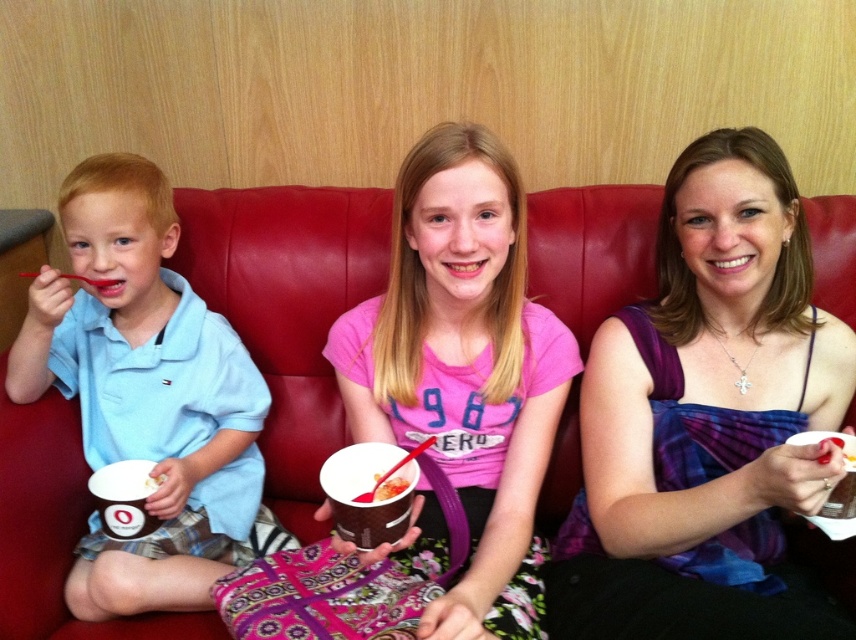
Does point (278, 504) come closer to viewer compared to point (174, 532)?

No, (278, 504) is further to viewer.

Which is above, red leather couch at center or light blue cotton shirt at left?

red leather couch at center

The image size is (856, 640). In order to click on red leather couch at center in this screenshot , I will do `click(287, 308)`.

You are a GUI agent. You are given a task and a screenshot of the screen. Output one action in this format:
    pyautogui.click(x=<x>, y=<y>)
    Task: Click on the red leather couch at center
    The height and width of the screenshot is (640, 856).
    Given the screenshot: What is the action you would take?
    pyautogui.click(x=287, y=308)

Which of these two, purple satin dress at center or light blue cotton shirt at left, stands shorter?

purple satin dress at center is shorter.

Does purple satin dress at center appear on the right side of light blue cotton shirt at left?

Indeed, purple satin dress at center is positioned on the right side of light blue cotton shirt at left.

Between point (700, 424) and point (150, 378), which one is positioned behind?

Point (150, 378)

At what (x,y) coordinates should I click in order to perform the action: click on purple satin dress at center. Please return your answer as a coordinate pair (x, y). The image size is (856, 640). Looking at the image, I should click on (706, 419).

Is the position of pink cotton shirt at center less distant than that of light blue cotton shirt at left?

Yes, pink cotton shirt at center is in front of light blue cotton shirt at left.

Is pink cotton shirt at center wider than light blue cotton shirt at left?

Incorrect, pink cotton shirt at center's width does not surpass light blue cotton shirt at left's.

Is point (530, 416) in front of point (123, 209)?

Yes, point (530, 416) is in front of point (123, 209).

Where is `pink cotton shirt at center`? The image size is (856, 640). pink cotton shirt at center is located at coordinates pos(461,381).